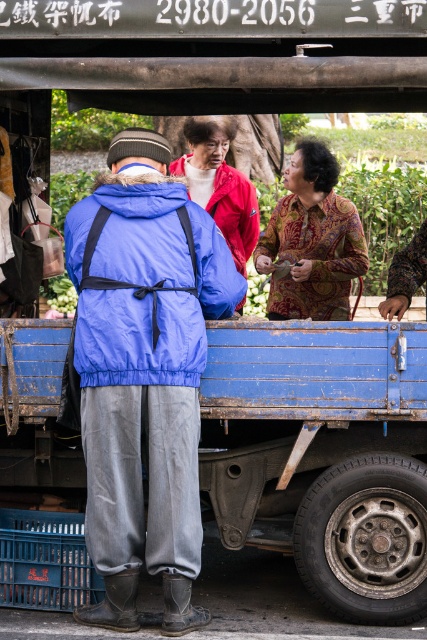
Can you confirm if blue fabric jacket at center is shorter than batik-patterned fabric at center?

No, blue fabric jacket at center is not shorter than batik-patterned fabric at center.

Does blue fabric jacket at center have a greater height compared to batik-patterned fabric at center?

Indeed, blue fabric jacket at center has a greater height compared to batik-patterned fabric at center.

Identify the location of blue fabric jacket at center. (143, 372).